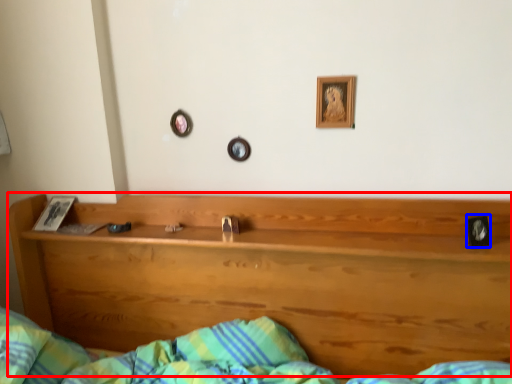
Question: Which object is closer to the camera taking this photo, bunk bed (highlighted by a red box) or picture frame (highlighted by a blue box)?

Choices:
 (A) bunk bed
 (B) picture frame

Answer: (A)